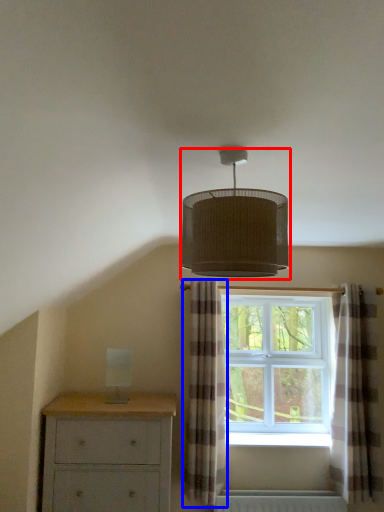
Question: Which of the following is the farthest to the observer, lamp (highlighted by a red box) or curtain (highlighted by a blue box)?

Choices:
 (A) lamp
 (B) curtain

Answer: (B)